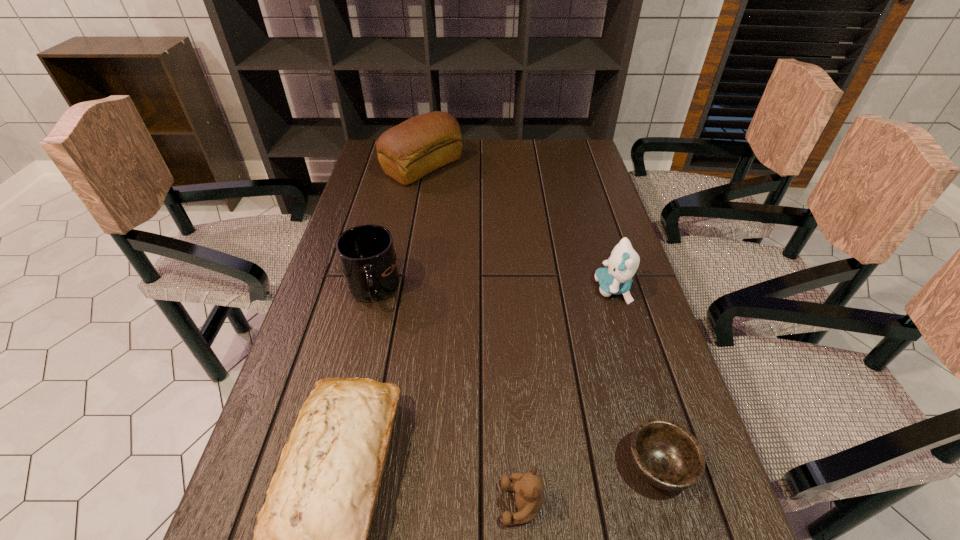
Locate an element on the screen. bowl present at the right edge is located at coordinates (668, 456).

Where is `object present at the far left corner`? The width and height of the screenshot is (960, 540). object present at the far left corner is located at coordinates (407, 152).

This screenshot has height=540, width=960. In the image, there is a desktop. What are the coordinates of `vacant region at the far edge` in the screenshot? It's located at (501, 152).

Locate an element on the screen. Image resolution: width=960 pixels, height=540 pixels. free space at the left edge of the desktop is located at coordinates (357, 357).

I want to click on vacant space at the right edge, so click(572, 220).

In the image, there is a desktop. Where is `vacant space at the far right corner`? The width and height of the screenshot is (960, 540). vacant space at the far right corner is located at coordinates (566, 143).

Where is `vacant area that lies between the bowl and the mug`? This screenshot has height=540, width=960. vacant area that lies between the bowl and the mug is located at coordinates (516, 378).

The height and width of the screenshot is (540, 960). Identify the location of unoccupied position between the fifth tallest object and the mug. (447, 397).

Find the location of a particular element. Image resolution: width=960 pixels, height=540 pixels. free space between the shortest object and the teddy bear is located at coordinates (590, 484).

Identify the location of free space between the kitten and the mug. The image size is (960, 540). (493, 290).